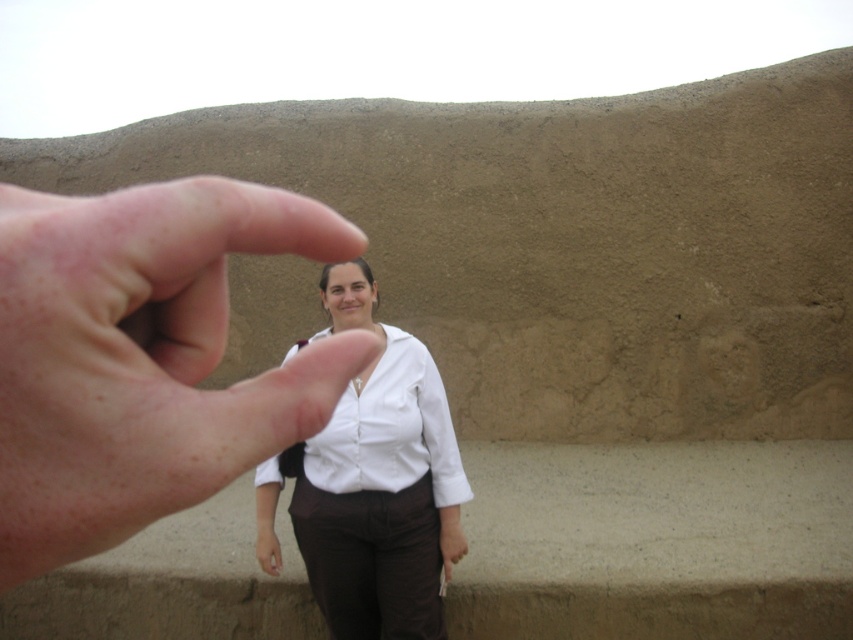
Question: Can you confirm if skinny flesh-toned finger at center is wider than white matte shirt at center?

Choices:
 (A) yes
 (B) no

Answer: (B)

Question: Which object is positioned closest to the skinny flesh-toned finger at center?

Choices:
 (A) white smooth shirt at center
 (B) white matte shirt at center

Answer: (A)

Question: Which object is closer to the camera taking this photo?

Choices:
 (A) white smooth shirt at center
 (B) skinny flesh-toned finger at center

Answer: (B)

Question: Which of the following is the farthest from the observer?

Choices:
 (A) (337, 426)
 (B) (1, 557)

Answer: (A)

Question: Where is skinny flesh-toned finger at center located in relation to white matte shirt at center in the image?

Choices:
 (A) above
 (B) below

Answer: (A)

Question: Is white matte shirt at center thinner than white smooth shirt at center?

Choices:
 (A) no
 (B) yes

Answer: (A)